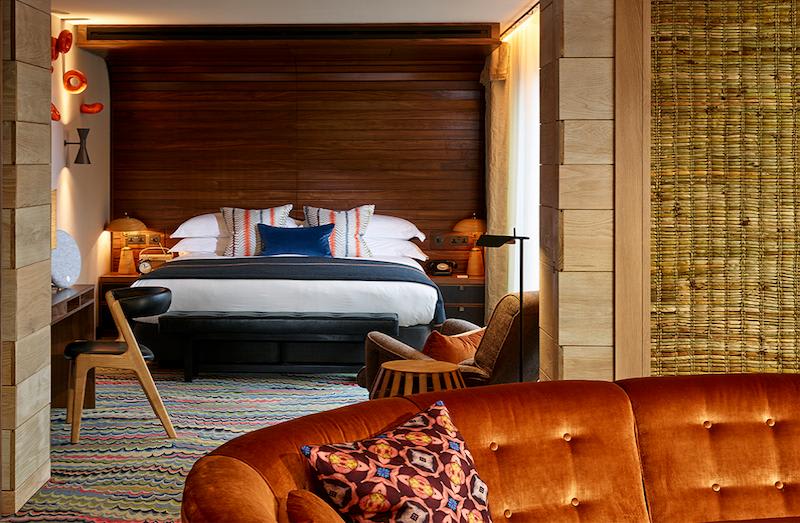
At what (x,y) coordinates should I click in order to perform the action: click on sofa. Please return your answer as a coordinate pair (x, y). The width and height of the screenshot is (800, 523). Looking at the image, I should click on click(549, 432).